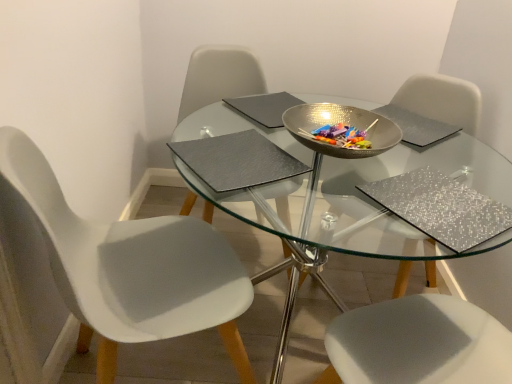
Question: From a real-world perspective, is silver glittery chair at upper right, which is the first chair in right-to-left order, over clear glass table at center?

Choices:
 (A) yes
 (B) no

Answer: (A)

Question: Considering the relative positions of silver glittery chair at upper right, arranged as the 3th chair when viewed from the left, and clear glass table at center in the image provided, is silver glittery chair at upper right, arranged as the 3th chair when viewed from the left, in front of clear glass table at center?

Choices:
 (A) no
 (B) yes

Answer: (A)

Question: Can we say silver glittery chair at upper right, which is the first chair in right-to-left order, lies outside clear glass table at center?

Choices:
 (A) no
 (B) yes

Answer: (A)

Question: Does silver glittery chair at upper right, arranged as the 3th chair when viewed from the left, have a lesser height compared to clear glass table at center?

Choices:
 (A) no
 (B) yes

Answer: (A)

Question: Can you confirm if silver glittery chair at upper right, which is the first chair in right-to-left order, is taller than clear glass table at center?

Choices:
 (A) yes
 (B) no

Answer: (A)

Question: Would you say matte gray chair at center, which is counted as the second chair, starting from the right, is inside or outside silver glittery chair at upper right, arranged as the 3th chair when viewed from the left?

Choices:
 (A) inside
 (B) outside

Answer: (B)

Question: Is matte gray chair at center, which is counted as the second chair, starting from the right, in front of or behind silver glittery chair at upper right, which is the first chair in right-to-left order, in the image?

Choices:
 (A) front
 (B) behind

Answer: (B)

Question: From the image's perspective, is matte gray chair at center, the second chair positioned from the left, above or below silver glittery chair at upper right, which is the first chair in right-to-left order?

Choices:
 (A) above
 (B) below

Answer: (A)

Question: Based on their sizes in the image, would you say matte gray chair at center, the second chair positioned from the left, is bigger or smaller than silver glittery chair at upper right, arranged as the 3th chair when viewed from the left?

Choices:
 (A) big
 (B) small

Answer: (A)

Question: In terms of height, does silver textured pad at upper center, which is the 2th pad in left-to-right order, look taller or shorter compared to matte gray place mat at center, which is counted as the 2th place mat, starting from the right?

Choices:
 (A) tall
 (B) short

Answer: (B)

Question: From a real-world perspective, is silver textured pad at upper center, which is the 2th pad in left-to-right order, above or below matte gray place mat at center, which is counted as the 2th place mat, starting from the right?

Choices:
 (A) above
 (B) below

Answer: (B)

Question: In the image, is silver textured pad at upper center, arranged as the first pad when viewed from the right, positioned in front of or behind matte gray place mat at center, which is counted as the 2th place mat, starting from the right?

Choices:
 (A) behind
 (B) front

Answer: (A)

Question: Would you say silver textured pad at upper center, which is the 2th pad in left-to-right order, is to the left or to the right of matte gray place mat at center, the 1th place mat viewed from the left, in the picture?

Choices:
 (A) right
 (B) left

Answer: (A)

Question: Considering their positions, is silver textured pad at upper center, which is the 2th pad in left-to-right order, located in front of or behind silver glittery placemat at lower right, positioned as the first place mat in right-to-left order?

Choices:
 (A) behind
 (B) front

Answer: (A)

Question: Do you think silver textured pad at upper center, which is the 2th pad in left-to-right order, is within silver glittery placemat at lower right, positioned as the first place mat in right-to-left order, or outside of it?

Choices:
 (A) outside
 (B) inside

Answer: (A)